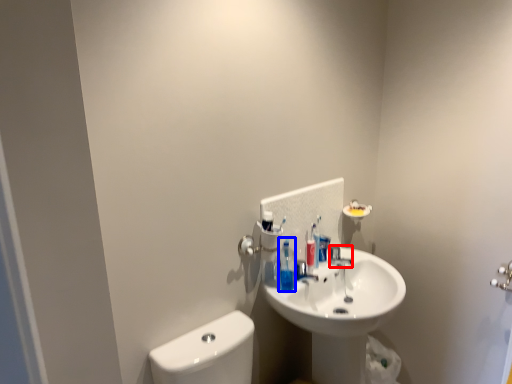
Question: Which object appears farthest to the camera in this image, plumbing fixture (highlighted by a red box) or toiletry (highlighted by a blue box)?

Choices:
 (A) plumbing fixture
 (B) toiletry

Answer: (A)